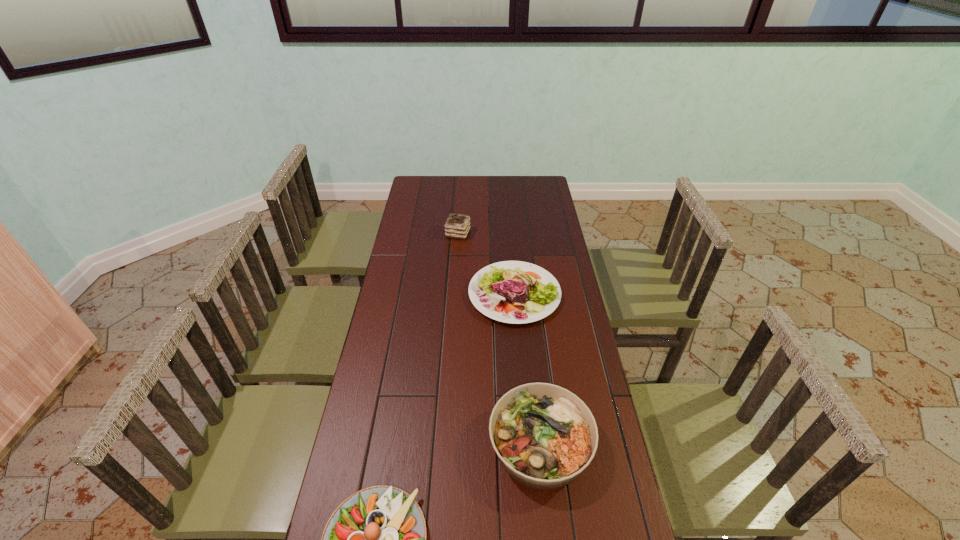
Select which object appears as the second closest to the chocolate cake. Please provide its 2D coordinates. Your answer should be formatted as a tuple, i.e. [(x, y)], where the tuple contains the x and y coordinates of a point satisfying the conditions above.

[(544, 436)]

Locate which salad plate is the closest to the leftmost salad plate. Please provide its 2D coordinates. Your answer should be formatted as a tuple, i.e. [(x, y)], where the tuple contains the x and y coordinates of a point satisfying the conditions above.

[(544, 436)]

Find the location of a particular element. the second closest salad plate to the third nearest object is located at coordinates (376, 539).